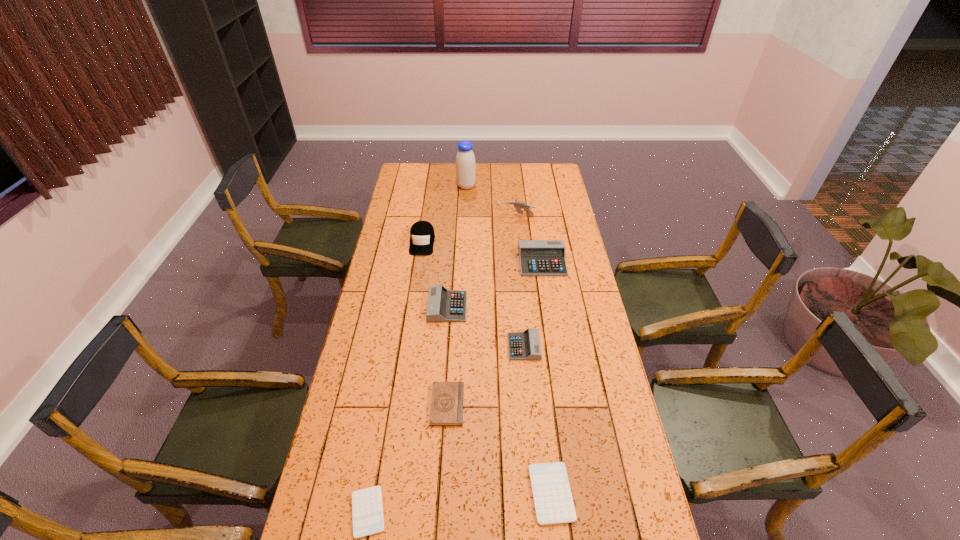
Locate an element on the screen. The image size is (960, 540). the third nearest object is located at coordinates (446, 409).

The image size is (960, 540). I want to click on the seventh tallest object, so click(x=446, y=409).

Locate an element on the screen. This screenshot has height=540, width=960. the right white calculator is located at coordinates (553, 501).

The width and height of the screenshot is (960, 540). Identify the location of the bigger white calculator. (553, 501).

This screenshot has height=540, width=960. I want to click on the shortest object, so click(367, 511).

Locate an element on the screen. This screenshot has height=540, width=960. the left white calculator is located at coordinates 367,511.

Locate an element on the screen. The height and width of the screenshot is (540, 960). vacant space located on the left of the farthest object is located at coordinates (426, 186).

The image size is (960, 540). What are the coordinates of `vacant point located at the barrel of the eighth nearest object` in the screenshot? It's located at (442, 217).

Image resolution: width=960 pixels, height=540 pixels. In order to click on free space located 0.360m at the barrel of the eighth nearest object in this screenshot , I will do `click(423, 217)`.

Identify the location of free space located 0.310m at the barrel of the eighth nearest object. Image resolution: width=960 pixels, height=540 pixels. (434, 217).